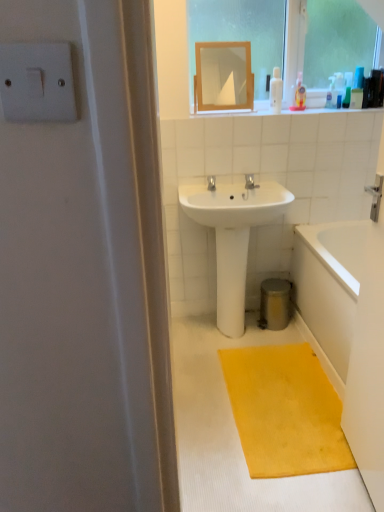
Question: Which is correct: white plastic light switch at upper left is inside wooden frame mirror at upper center, or outside of it?

Choices:
 (A) outside
 (B) inside

Answer: (A)

Question: Considering the positions of white plastic light switch at upper left and wooden frame mirror at upper center in the image, is white plastic light switch at upper left taller or shorter than wooden frame mirror at upper center?

Choices:
 (A) short
 (B) tall

Answer: (A)

Question: Which object is the farthest from the white plastic bottle at upper right, which is counted as the third toiletry, starting from the right?

Choices:
 (A) white glossy bathtub at lower right
 (B) translucent plastic bottle at upper right, the 3th toiletry when ordered from left to right
 (C) white plastic light switch at upper left
 (D) transparent glass mirror at upper center
 (E) wooden frame mirror at upper center

Answer: (C)

Question: Estimate the real-world distances between objects in this image. Which object is farther from the translucent plastic bottle at upper right, the 3th toiletry when ordered from left to right?

Choices:
 (A) white ceramic sink at center
 (B) white glossy bathtub at lower right
 (C) wooden frame mirror at upper center
 (D) translucent plastic soap dispenser at upper right, the second toiletry in the right-to-left sequence
 (E) transparent glass mirror at upper center

Answer: (C)